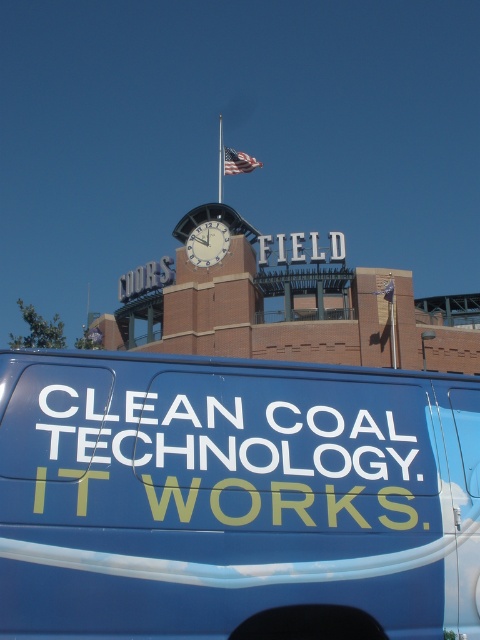
Question: Which point is farther to the camera?

Choices:
 (A) (69, 467)
 (B) (118, 516)

Answer: (A)

Question: Which point is farther to the camera?

Choices:
 (A) (208, 477)
 (B) (195, 256)
 (C) (199, 522)

Answer: (B)

Question: Is blue matte van at lower center to the right of white glossy clock at center from the viewer's perspective?

Choices:
 (A) no
 (B) yes

Answer: (B)

Question: Which of these objects is positioned farthest from the blue matte van at lower center?

Choices:
 (A) whitematerial/textureclean coal technology it works at upper center
 (B) white glossy clock at center

Answer: (B)

Question: Does blue matte van at lower center lie behind white glossy clock at center?

Choices:
 (A) yes
 (B) no

Answer: (B)

Question: Does whitematerial/textureclean coal technology it works at upper center have a greater width compared to white glossy clock at center?

Choices:
 (A) no
 (B) yes

Answer: (A)